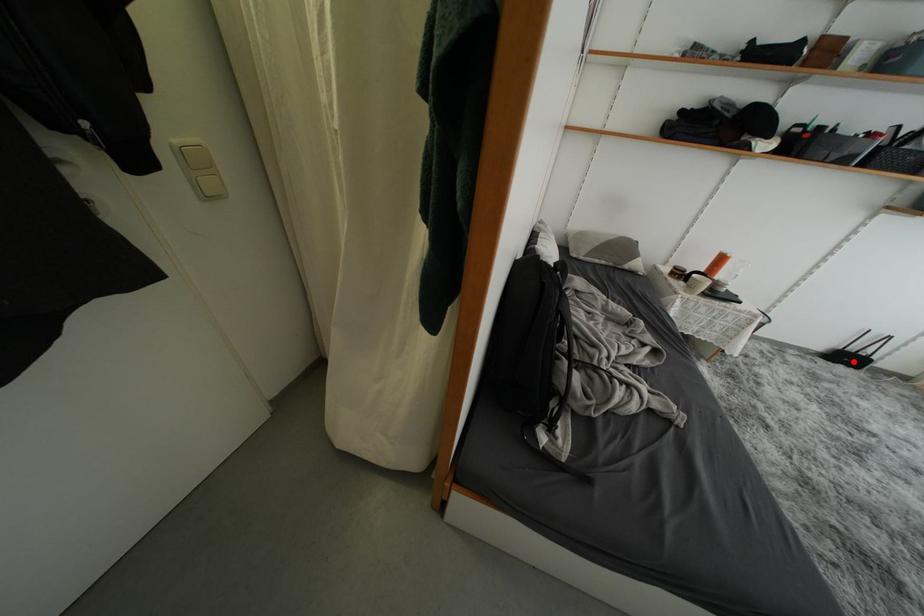
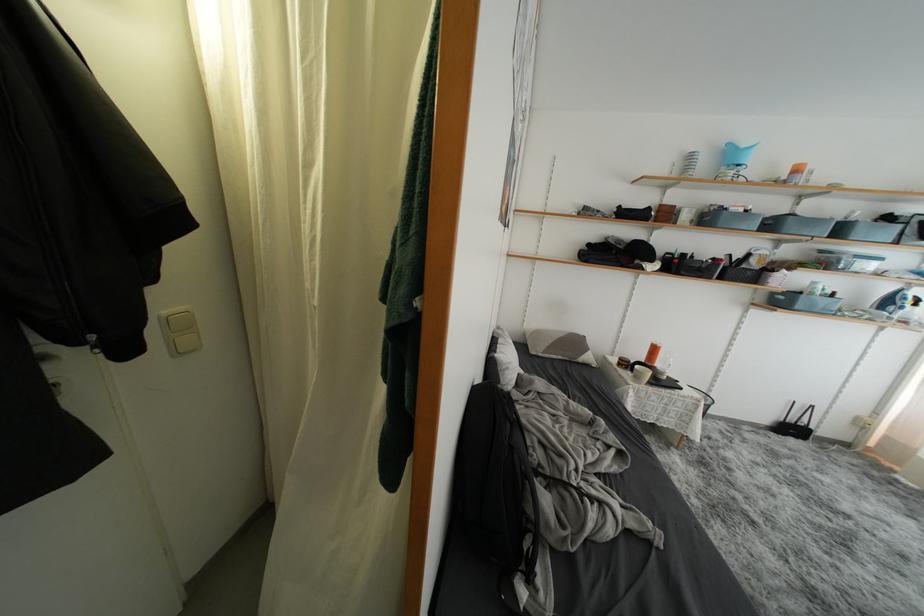
Find the pixel in the second image that matches the highlighted location in the first image.

(797, 434)